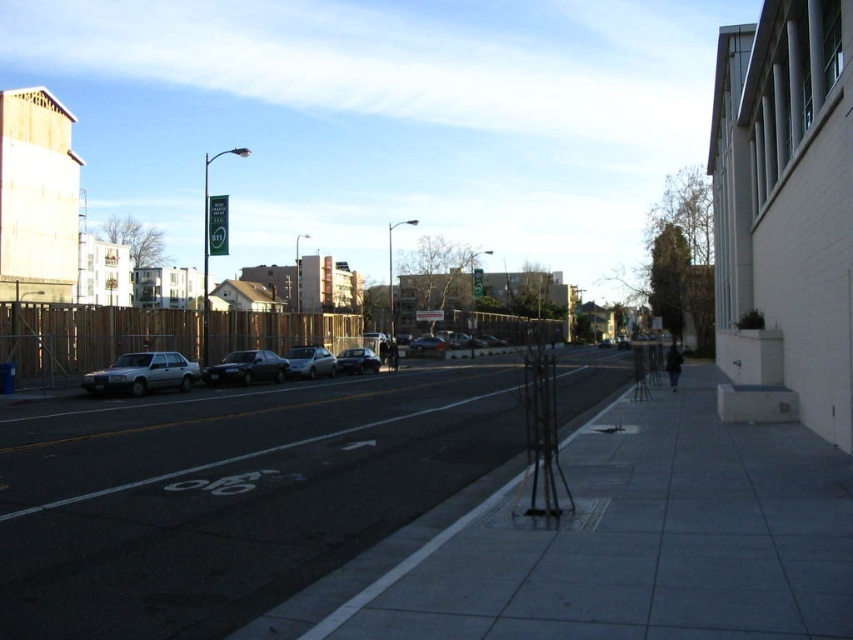
In the scene shown: You are a delivery person carrying a large package and need to walk along the gray concrete sidewalk at center while avoiding the silver metallic sedan at left. Can you fit through the space between them?

The gray concrete sidewalk at center has a larger size compared to the silver metallic sedan at left, so yes, you can fit through the space between them since the sidewalk is wider than the sedan.

You are a delivery person with a 1.5 meter wide delivery cart. You need to move from the gray concrete sidewalk at center to the silver metallic sedan at left. Can your cart fit through the space between them?

The gray concrete sidewalk at center and the silver metallic sedan at left are 21.33 meters apart, so yes, the delivery cart can fit through the space between them since the distance is much wider than the cart.